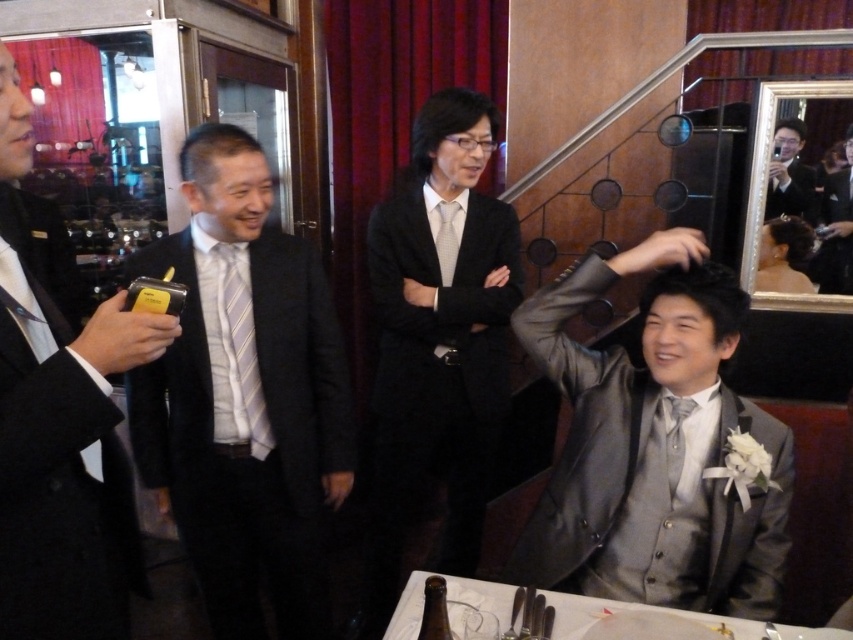
Is point (233, 276) positioned before point (447, 260)?

Yes, it is in front of point (447, 260).

Is striped silk tie at center in front of matte gray tie at center?

Yes, striped silk tie at center is closer to the viewer.

What do you see at coordinates (245, 352) in the screenshot?
I see `striped silk tie at center` at bounding box center [245, 352].

What are the coordinates of `striped silk tie at center` in the screenshot? It's located at (245, 352).

From the picture: Who is shorter, dark gray suit at left or shiny black suit at upper right?

With less height is shiny black suit at upper right.

Is dark gray suit at left further to camera compared to shiny black suit at upper right?

No, it is in front of shiny black suit at upper right.

Locate an element on the screen. The height and width of the screenshot is (640, 853). dark gray suit at left is located at coordinates (244, 396).

Is shiny black suit at upper right positioned behind matte gray tie at center?

Yes, it is.

The image size is (853, 640). What do you see at coordinates (836, 228) in the screenshot?
I see `shiny black suit at upper right` at bounding box center [836, 228].

Who is more forward, (850, 221) or (450, 200)?

Point (450, 200) is more forward.

You are a GUI agent. You are given a task and a screenshot of the screen. Output one action in this format:
    pyautogui.click(x=<x>, y=<y>)
    Task: Click on the shiny black suit at upper right
    This screenshot has width=853, height=640.
    Given the screenshot: What is the action you would take?
    pyautogui.click(x=836, y=228)